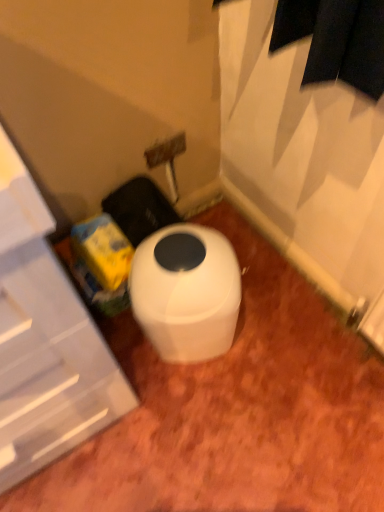
Locate an element on the screen. The image size is (384, 512). unoccupied region to the right of white plastic cabinet at left is located at coordinates (220, 399).